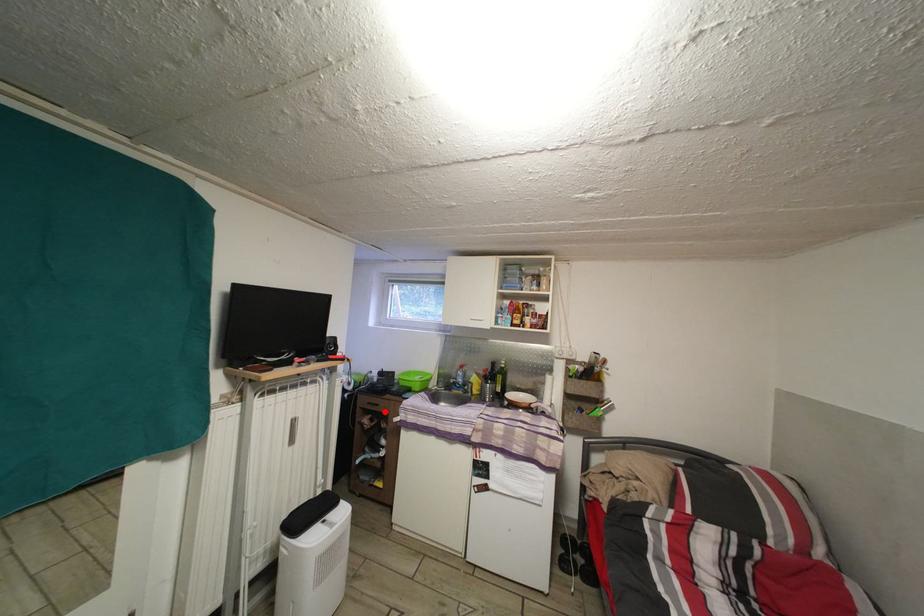
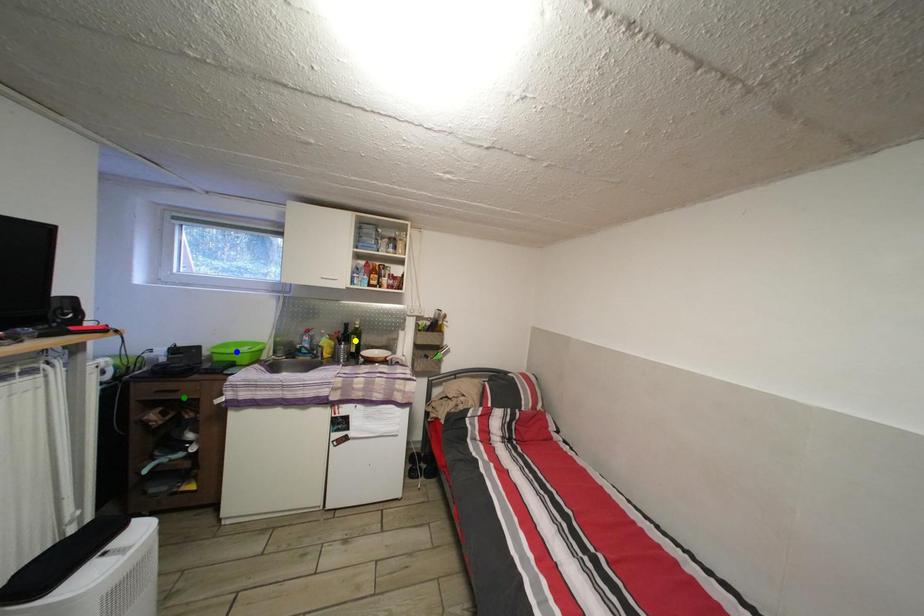
Question: I am providing you with two images of the same scene from different viewpoints. A red point is marked on the first image. You are given multiple points on the second image. Which point in image 2 represents the same 3d spot as the red point in image 1?

Choices:
 (A) blue point
 (B) yellow point
 (C) green point

Answer: (C)